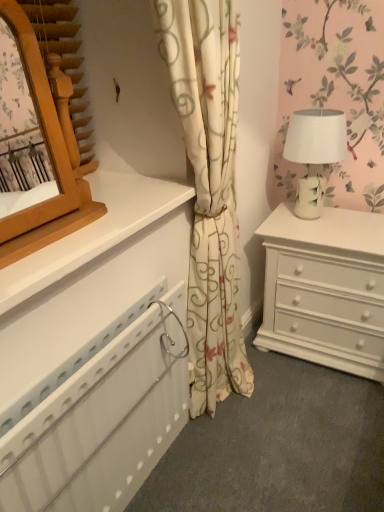
Question: Looking at their shapes, would you say white plastic radiator at lower left is wider or thinner than white ceramic table lamp at right?

Choices:
 (A) thin
 (B) wide

Answer: (A)

Question: In the image, is white plastic radiator at lower left on the left side or the right side of white ceramic table lamp at right?

Choices:
 (A) left
 (B) right

Answer: (A)

Question: Which is nearer to the white floral curtain at center?

Choices:
 (A) white plastic radiator at lower left
 (B) wooden mirror at upper left
 (C) white ceramic table lamp at right

Answer: (A)

Question: Which object is positioned farthest from the white floral curtain at center?

Choices:
 (A) white ceramic table lamp at right
 (B) wooden mirror at upper left
 (C) white plastic radiator at lower left

Answer: (A)